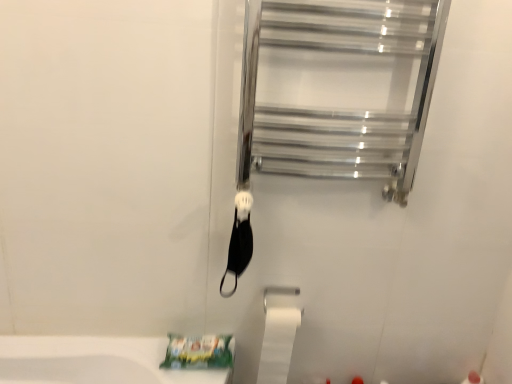
This screenshot has height=384, width=512. In order to click on white matte toilet paper at lower center in this screenshot , I will do 278,344.

Image resolution: width=512 pixels, height=384 pixels. What do you see at coordinates (278, 344) in the screenshot?
I see `white matte toilet paper at lower center` at bounding box center [278, 344].

What are the coordinates of `clear glass towel rack at upper right` in the screenshot? It's located at (338, 89).

The height and width of the screenshot is (384, 512). What do you see at coordinates (338, 89) in the screenshot?
I see `clear glass towel rack at upper right` at bounding box center [338, 89].

Identify the location of white matte toilet paper at lower center. (278, 344).

Which object is positioned more to the left, white matte toilet paper at lower center or clear glass towel rack at upper right?

Positioned to the left is white matte toilet paper at lower center.

Considering the positions of objects white matte toilet paper at lower center and clear glass towel rack at upper right in the image provided, who is in front, white matte toilet paper at lower center or clear glass towel rack at upper right?

clear glass towel rack at upper right is more forward.

Is point (267, 313) closer to camera compared to point (258, 56)?

No, (267, 313) is further to viewer.

From the image's perspective, is white matte toilet paper at lower center positioned above or below clear glass towel rack at upper right?

white matte toilet paper at lower center is below clear glass towel rack at upper right.

From a real-world perspective, is white matte toilet paper at lower center positioned over clear glass towel rack at upper right based on gravity?

No.

Can you confirm if white matte toilet paper at lower center is thinner than clear glass towel rack at upper right?

Correct, the width of white matte toilet paper at lower center is less than that of clear glass towel rack at upper right.

Who is shorter, white matte toilet paper at lower center or clear glass towel rack at upper right?

Standing shorter between the two is white matte toilet paper at lower center.

Does white matte toilet paper at lower center have a smaller size compared to clear glass towel rack at upper right?

Yes.

Is white matte toilet paper at lower center inside the boundaries of clear glass towel rack at upper right, or outside?

white matte toilet paper at lower center is not enclosed by clear glass towel rack at upper right.

Are white matte toilet paper at lower center and clear glass towel rack at upper right located far from each other?

No, white matte toilet paper at lower center is in close proximity to clear glass towel rack at upper right.

Is white matte toilet paper at lower center positioned with its back to clear glass towel rack at upper right?

No, clear glass towel rack at upper right is not at the back of white matte toilet paper at lower center.

How different are the orientations of white matte toilet paper at lower center and clear glass towel rack at upper right in degrees?

0.306 degrees separate the facing orientations of white matte toilet paper at lower center and clear glass towel rack at upper right.

There is a white matte toilet paper at lower center. Identify the location of glass door above it (from a real-world perspective). (338, 89).

Between clear glass towel rack at upper right and white matte toilet paper at lower center, which one appears on the left side from the viewer's perspective?

white matte toilet paper at lower center is more to the left.

Which is in front, clear glass towel rack at upper right or white matte toilet paper at lower center?

Positioned in front is clear glass towel rack at upper right.

Is point (351, 105) positioned after point (283, 318)?

No, (351, 105) is in front of (283, 318).

From the image's perspective, is clear glass towel rack at upper right located beneath white matte toilet paper at lower center?

Incorrect, from the image's perspective, clear glass towel rack at upper right is higher than white matte toilet paper at lower center.

From a real-world perspective, which is physically below, clear glass towel rack at upper right or white matte toilet paper at lower center?

In real-world perspective, white matte toilet paper at lower center is lower.

Can you confirm if clear glass towel rack at upper right is wider than white matte toilet paper at lower center?

Yes, clear glass towel rack at upper right is wider than white matte toilet paper at lower center.

Considering the sizes of objects clear glass towel rack at upper right and white matte toilet paper at lower center in the image provided, who is taller, clear glass towel rack at upper right or white matte toilet paper at lower center?

With more height is clear glass towel rack at upper right.

Looking at the image, does clear glass towel rack at upper right seem bigger or smaller compared to white matte toilet paper at lower center?

In the image, clear glass towel rack at upper right appears to be larger than white matte toilet paper at lower center.

Would you say clear glass towel rack at upper right contains white matte toilet paper at lower center?

No, white matte toilet paper at lower center is located outside of clear glass towel rack at upper right.

Can you see clear glass towel rack at upper right touching white matte toilet paper at lower center?

No.

Is clear glass towel rack at upper right turned away from white matte toilet paper at lower center?

That's not correct — clear glass towel rack at upper right is not looking away from white matte toilet paper at lower center.

Measure the distance from clear glass towel rack at upper right to white matte toilet paper at lower center.

The distance of clear glass towel rack at upper right from white matte toilet paper at lower center is 26.46 inches.

Identify the location of toilet paper on the left of clear glass towel rack at upper right. The height and width of the screenshot is (384, 512). (278, 344).

Image resolution: width=512 pixels, height=384 pixels. In order to click on toilet paper on the left of clear glass towel rack at upper right in this screenshot , I will do `click(278, 344)`.

Identify the location of glass door that appears above the white matte toilet paper at lower center (from a real-world perspective). (338, 89).